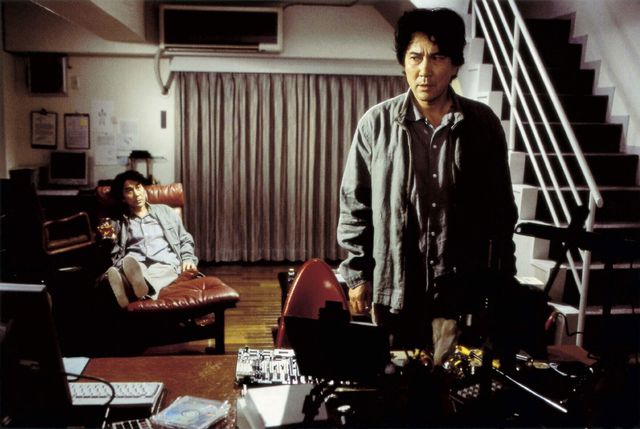
Locate an element on the screen. This screenshot has width=640, height=429. curtain is located at coordinates (230, 146).